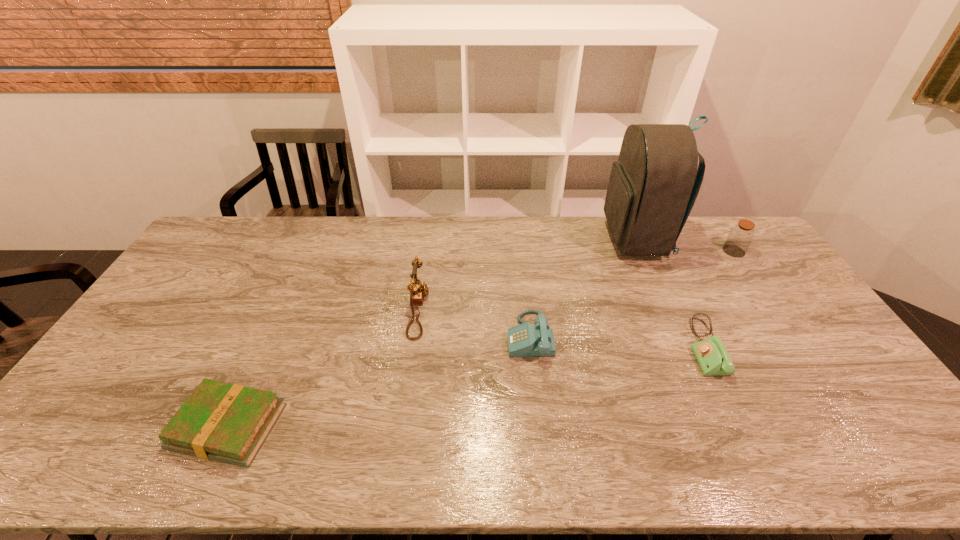
The width and height of the screenshot is (960, 540). In order to click on the tallest object in this screenshot , I will do `click(652, 189)`.

Image resolution: width=960 pixels, height=540 pixels. Find the location of `the second object from left to right`. the second object from left to right is located at coordinates (418, 289).

This screenshot has height=540, width=960. I want to click on the tallest telephone, so click(x=418, y=289).

Where is `the rightmost object`? This screenshot has height=540, width=960. the rightmost object is located at coordinates (741, 235).

What are the coordinates of `the second tallest telephone` in the screenshot? It's located at (524, 340).

Where is `the fourth object from right to left`? The image size is (960, 540). the fourth object from right to left is located at coordinates (524, 340).

The image size is (960, 540). Identify the location of the rightmost telephone. (713, 358).

At what (x,y) coordinates should I click in order to perform the action: click on the nearest object. Please return your answer as a coordinate pair (x, y). Looking at the image, I should click on (220, 421).

I want to click on book, so click(220, 421).

Identify the location of vacant space located on the front-facing side of the tallest object. This screenshot has height=540, width=960. (564, 239).